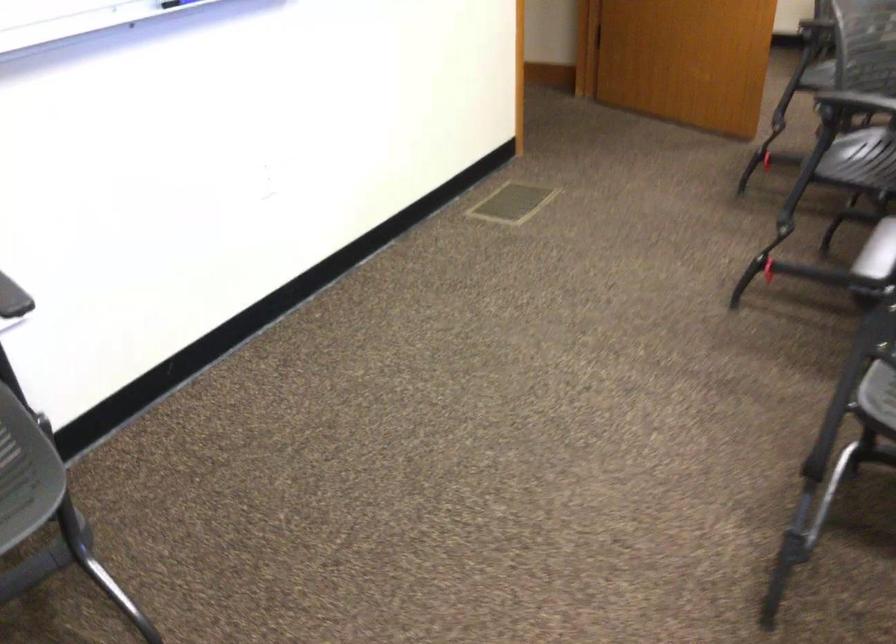
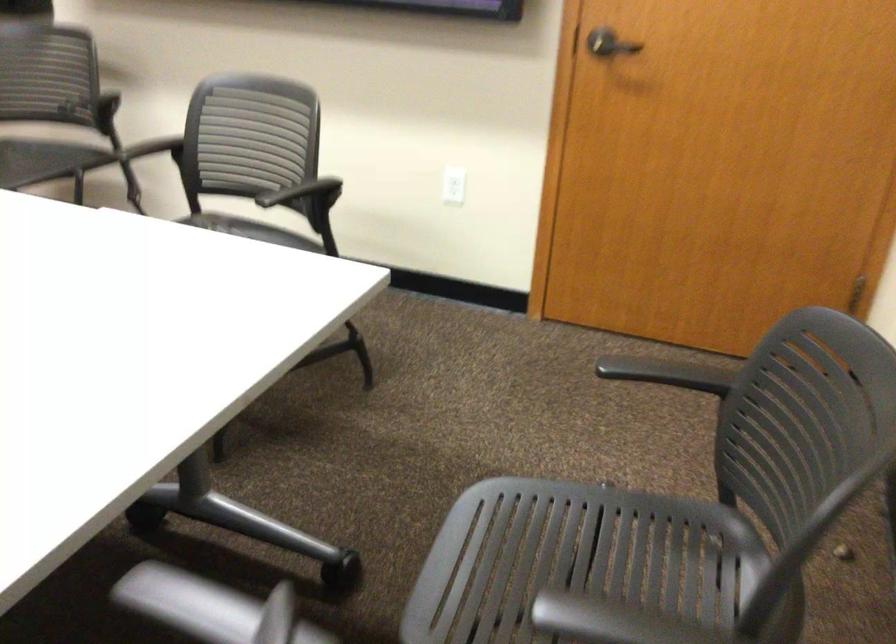
Looking at this image, the images are taken continuously from a first-person perspective. In which direction are you moving?

The cameraman moved toward right, forward.